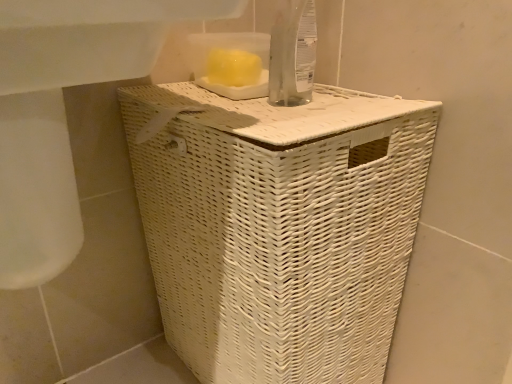
Question: Considering the positions of point (202, 225) and point (159, 1), is point (202, 225) closer or farther from the camera than point (159, 1)?

Choices:
 (A) closer
 (B) farther

Answer: (B)

Question: Is white wicker laundry basket at center taller or shorter than white wicker basket at lower center?

Choices:
 (A) short
 (B) tall

Answer: (B)

Question: Based on their positions, is white wicker laundry basket at center located to the left or right of white wicker basket at lower center?

Choices:
 (A) right
 (B) left

Answer: (A)

Question: In terms of width, does white wicker basket at lower center look wider or thinner when compared to white wicker laundry basket at center?

Choices:
 (A) thin
 (B) wide

Answer: (B)

Question: Is point (64, 51) positioned closer to the camera than point (369, 144)?

Choices:
 (A) closer
 (B) farther

Answer: (A)

Question: From the image's perspective, relative to white wicker laundry basket at center, is white wicker basket at lower center above or below?

Choices:
 (A) below
 (B) above

Answer: (B)

Question: In terms of size, does white wicker basket at lower center appear bigger or smaller than white wicker laundry basket at center?

Choices:
 (A) big
 (B) small

Answer: (B)